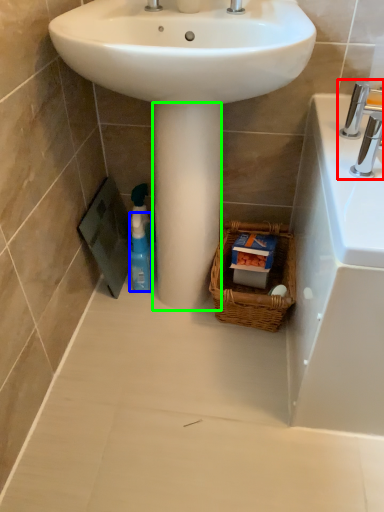
Question: Based on their relative distances, which object is farther from tap (highlighted by a red box)? Choose from cleaning product (highlighted by a blue box) and pillar (highlighted by a green box).

Choices:
 (A) cleaning product
 (B) pillar

Answer: (A)